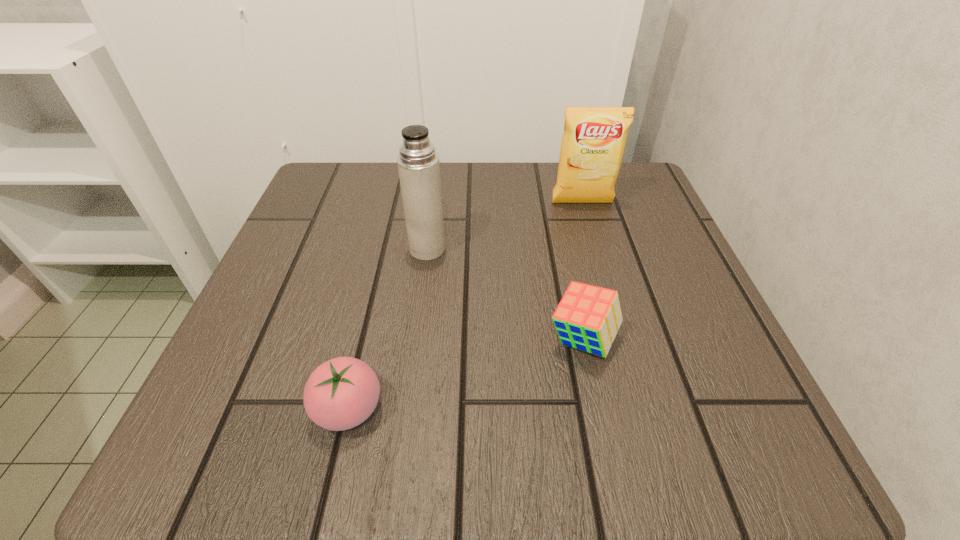
Where is `thermos bottle`? thermos bottle is located at coordinates (418, 163).

You are a GUI agent. You are given a task and a screenshot of the screen. Output one action in this format:
    pyautogui.click(x=<x>, y=<y>)
    Task: Click on the farthest object
    The width and height of the screenshot is (960, 540).
    Given the screenshot: What is the action you would take?
    pyautogui.click(x=593, y=143)

In order to click on cube in this screenshot , I will do `click(588, 317)`.

Where is `tomato`? This screenshot has height=540, width=960. tomato is located at coordinates (341, 393).

Identify the location of vacant area located 0.350m on the front of the third nearest object. (401, 450).

Locate an element on the screen. The image size is (960, 540). free spot located 0.260m on the front of the crisp (potato chip) with the logo is located at coordinates (611, 302).

Locate an element on the screen. free region located 0.280m on the left of the cube is located at coordinates (361, 340).

Where is `free region located on the back of the nearest object`? The width and height of the screenshot is (960, 540). free region located on the back of the nearest object is located at coordinates (384, 256).

At what (x,y) coordinates should I click in order to perform the action: click on object positioned at the far edge. Please return your answer as a coordinate pair (x, y). The height and width of the screenshot is (540, 960). Looking at the image, I should click on (x=593, y=143).

The height and width of the screenshot is (540, 960). I want to click on object present at the near edge, so click(341, 393).